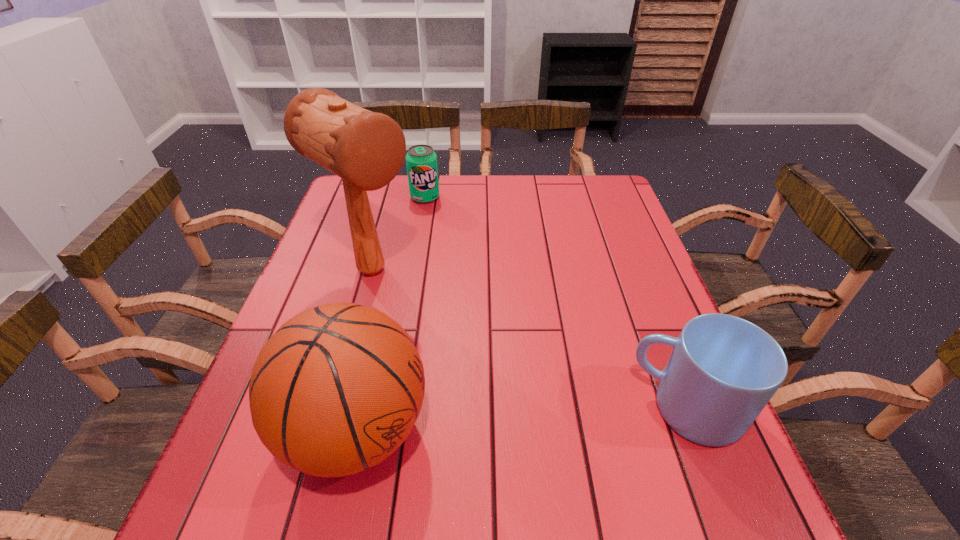
You are a GUI agent. You are given a task and a screenshot of the screen. Output one action in this format:
    pyautogui.click(x=<x>, y=<y>)
    Task: Click on the blank space located on the front-facing side of the pop soda
    Image resolution: width=960 pixels, height=540 pixels.
    Given the screenshot: What is the action you would take?
    pyautogui.click(x=452, y=255)

Locate an element on the screen. free space located on the front-facing side of the pop soda is located at coordinates (456, 261).

The image size is (960, 540). In order to click on vacant space situated on the front-facing side of the pop soda in this screenshot , I will do pyautogui.click(x=451, y=253).

Image resolution: width=960 pixels, height=540 pixels. What are the coordinates of `object that is at the far edge` in the screenshot? It's located at (421, 161).

Where is `basketball that is at the near edge`? The height and width of the screenshot is (540, 960). basketball that is at the near edge is located at coordinates (337, 389).

Find the location of `mug that is at the near edge`. mug that is at the near edge is located at coordinates (723, 370).

Locate an element on the screen. The height and width of the screenshot is (540, 960). basketball positioned at the left edge is located at coordinates (337, 389).

At what (x,y) coordinates should I click in order to perform the action: click on mallet at the left edge. Please return your answer as a coordinate pair (x, y). The width and height of the screenshot is (960, 540). Looking at the image, I should click on pos(366,149).

The width and height of the screenshot is (960, 540). I want to click on object that is at the right edge, so click(x=723, y=370).

Find the location of a particular element. This screenshot has width=960, height=540. object that is positioned at the near left corner is located at coordinates (337, 389).